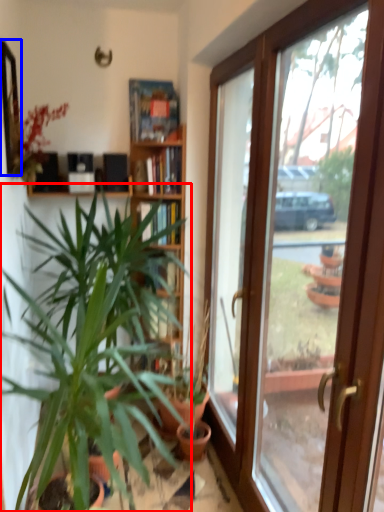
Question: Which point is closer to the camera, houseplant (highlighted by a red box) or mirror (highlighted by a blue box)?

Choices:
 (A) houseplant
 (B) mirror

Answer: (B)